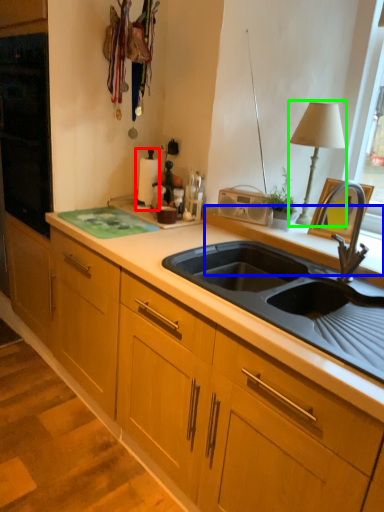
Question: Which object is positioned closest to appliance (highlighted by a red box)? Select from window sill (highlighted by a blue box) and table lamp (highlighted by a green box).

Choices:
 (A) window sill
 (B) table lamp

Answer: (A)